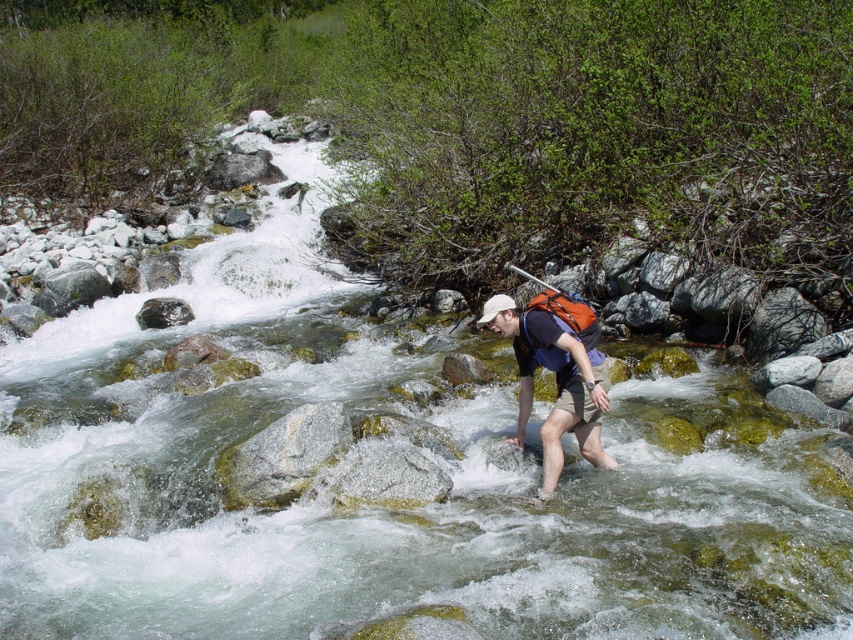
Is matte black backpack at center shorter than orange fabric paddle at center?

No.

Between matte black backpack at center and orange fabric paddle at center, which one is positioned lower?

matte black backpack at center is lower down.

The width and height of the screenshot is (853, 640). What do you see at coordinates (556, 381) in the screenshot?
I see `matte black backpack at center` at bounding box center [556, 381].

Locate an element on the screen. matte black backpack at center is located at coordinates (556, 381).